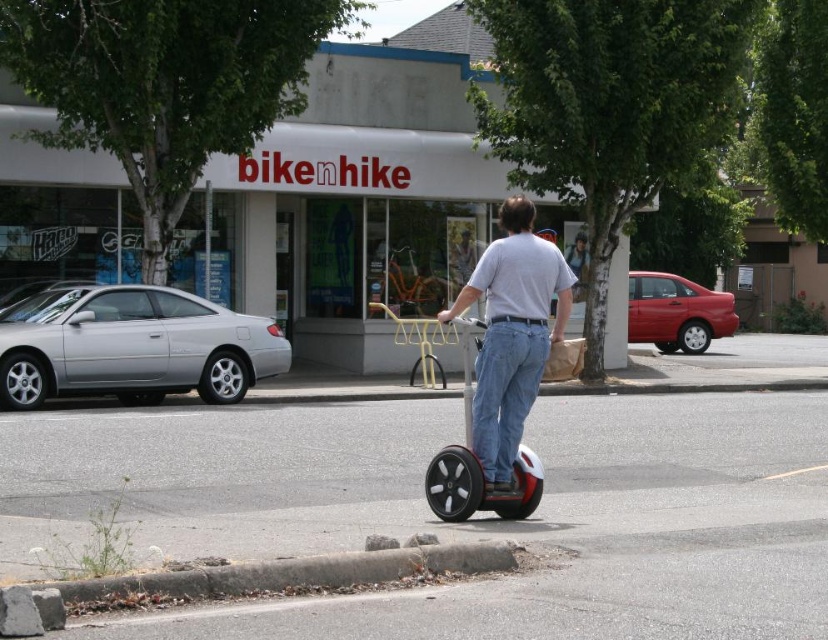
Based on the photo, you are a delivery driver who needs to park your red glossy scooter at center. The parking area is behind the white matte storefront at center. Is your scooter already in the correct parking spot?

The red glossy scooter at center is behind the white matte storefront at center, so yes, it is already parked in the correct parking spot.

From the picture: You are a delivery person on a Segway and need to deliver a package to the store. Which direction should you turn to face the white matte storefront at center from the white matte segway at center?

You should turn to your left because the white matte storefront at center is located to the left of the white matte segway at center.

You are a delivery person trying to navigate through the street scene. You need to pass by both the white matte storefront at center and the white matte segway at center. Which one should you go around first based on their sizes?

The white matte storefront at center is much taller than the white matte segway at center, so you should go around the white matte segway at center first since it is lower and might be in your path closer to the ground.